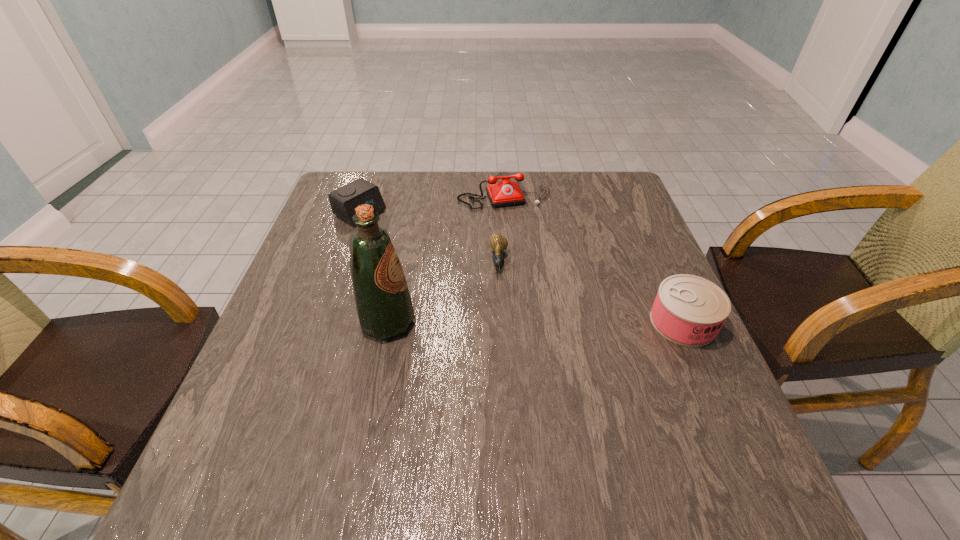
Image resolution: width=960 pixels, height=540 pixels. In order to click on the tallest object in this screenshot , I will do `click(383, 304)`.

The width and height of the screenshot is (960, 540). I want to click on olive oil, so click(383, 304).

Identify the location of the rightmost object. This screenshot has width=960, height=540. 688,310.

The height and width of the screenshot is (540, 960). What are the coordinates of `the leftmost object` in the screenshot? It's located at (344, 200).

At what (x,y) coordinates should I click in order to perform the action: click on telephone. Please return your answer as a coordinate pair (x, y). Looking at the image, I should click on point(504,193).

Find the location of a particular element. The height and width of the screenshot is (540, 960). escargot is located at coordinates (498, 242).

This screenshot has width=960, height=540. I want to click on the shortest object, so click(x=498, y=242).

This screenshot has height=540, width=960. I want to click on vacant region located on the front-facing side of the tallest object, so click(x=452, y=322).

This screenshot has height=540, width=960. I want to click on vacant area located 0.160m on the left of the can, so click(577, 322).

Where is `vacant space located on the front-facing side of the alarm clock`? The height and width of the screenshot is (540, 960). vacant space located on the front-facing side of the alarm clock is located at coordinates (398, 236).